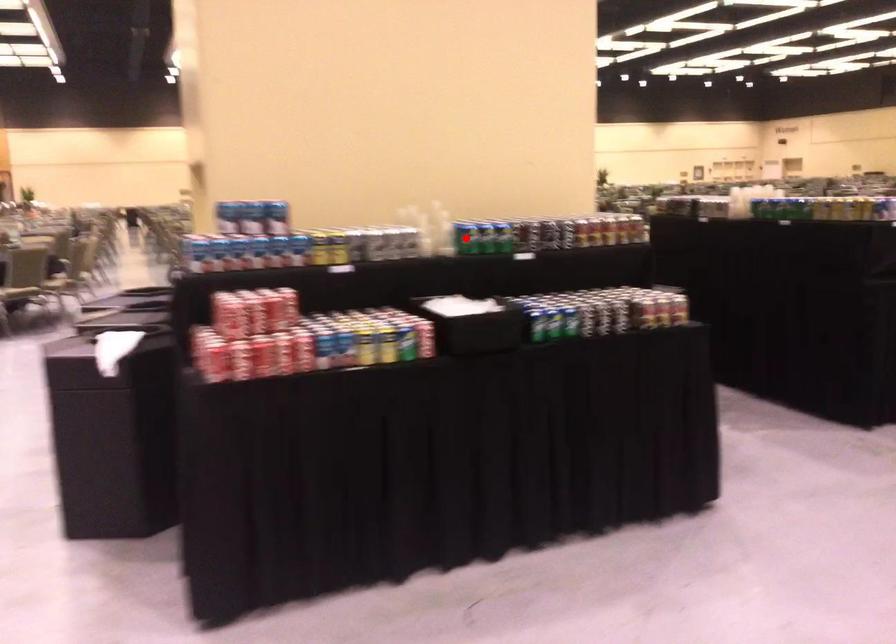
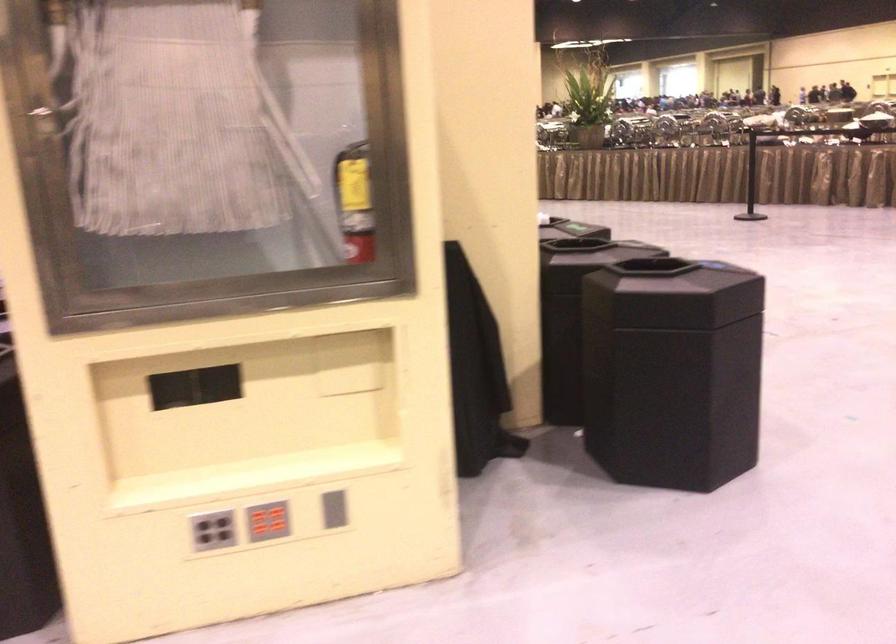
Question: I am providing you with two images of the same scene from different viewpoints. A red point is marked on the first image. Can you still see the location of the red point in image 2?

Choices:
 (A) Yes
 (B) No

Answer: (B)